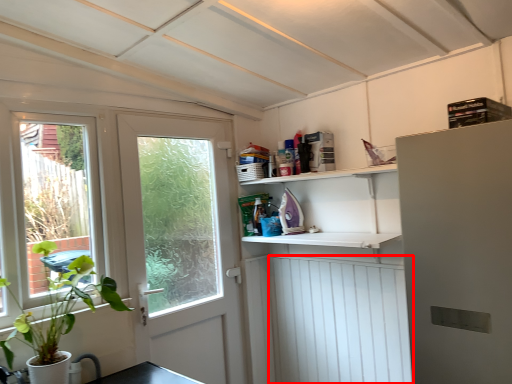
Question: Where is screen door (annotated by the red box) located in relation to door in the image?

Choices:
 (A) left
 (B) right

Answer: (B)